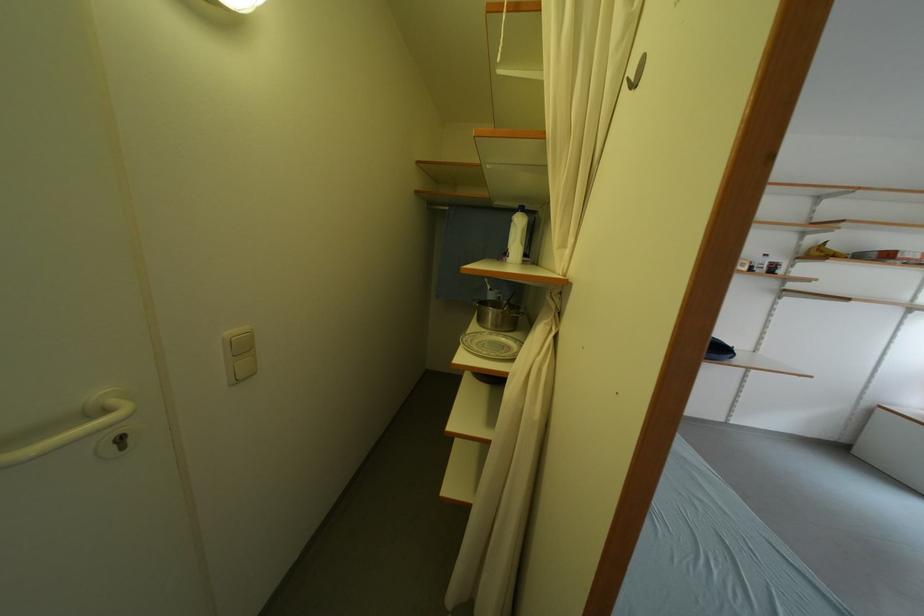
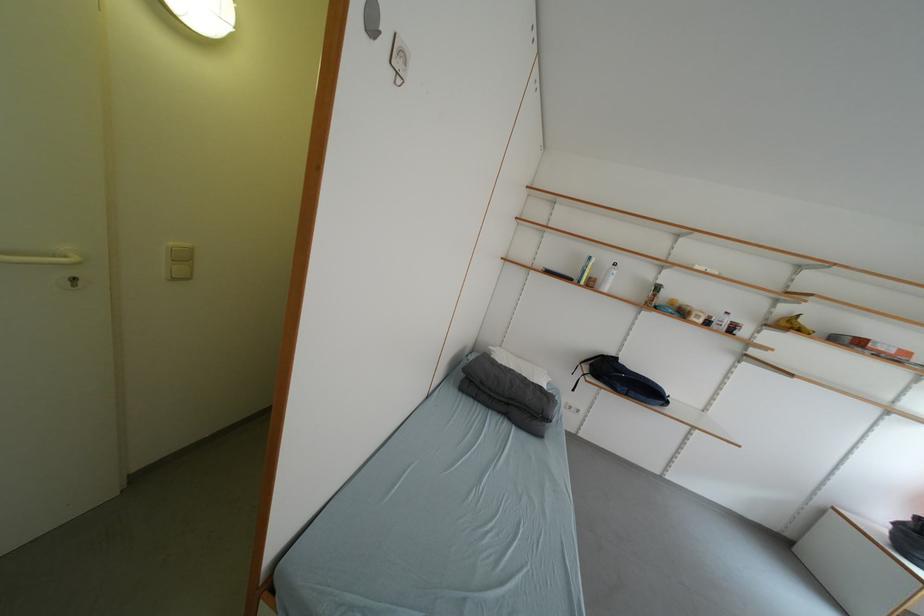
Find the pixel in the second image that matches [879,415] in the first image.

(832, 515)